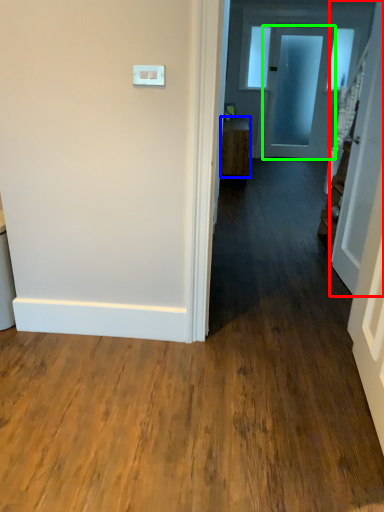
Question: Estimate the real-world distances between objects in this image. Which object is closer to door (highlighted by a red box), furniture (highlighted by a blue box) or door (highlighted by a green box)?

Choices:
 (A) furniture
 (B) door

Answer: (A)